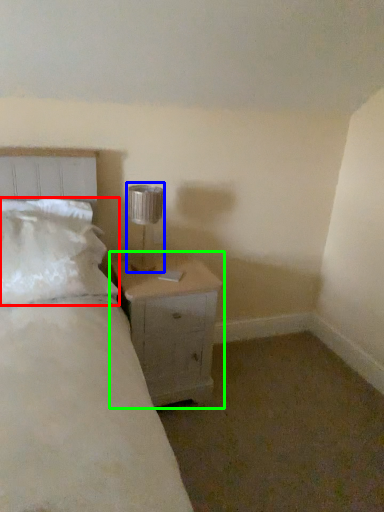
Question: Estimate the real-world distances between objects in this image. Which object is closer to pillow (highlighted by a red box), lamp (highlighted by a blue box) or nightstand (highlighted by a green box)?

Choices:
 (A) lamp
 (B) nightstand

Answer: (B)